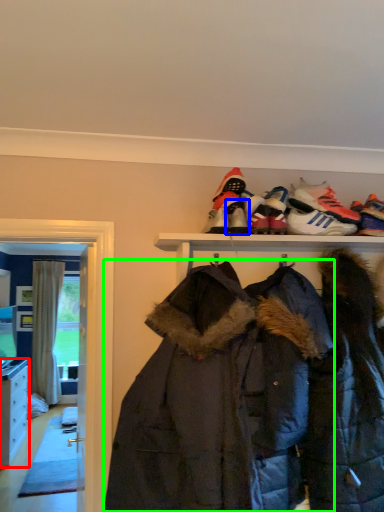
Question: Based on their relative distances, which object is farther from cabinetry (highlighted by a red box)? Choose from footwear (highlighted by a blue box) and jacket (highlighted by a green box).

Choices:
 (A) footwear
 (B) jacket

Answer: (A)